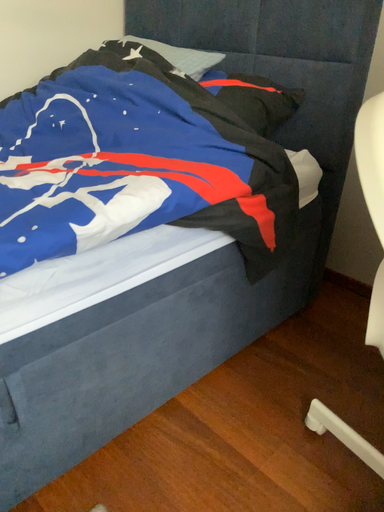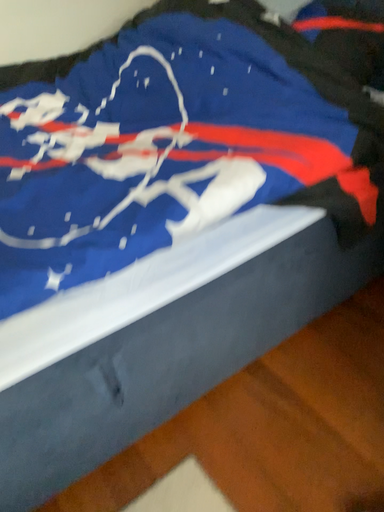
Question: Which way did the camera rotate in the video?

Choices:
 (A) rotated upward
 (B) rotated downward

Answer: (B)